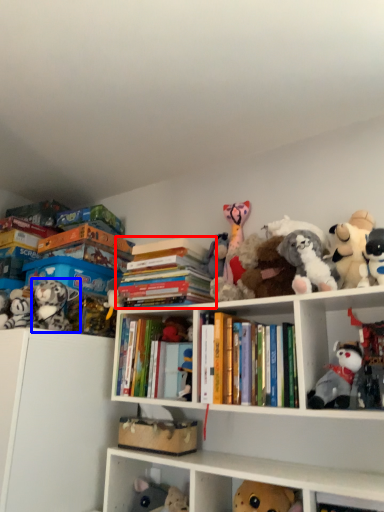
Question: Which point is further to the camera, book (highlighted by a red box) or toy (highlighted by a blue box)?

Choices:
 (A) book
 (B) toy

Answer: (B)